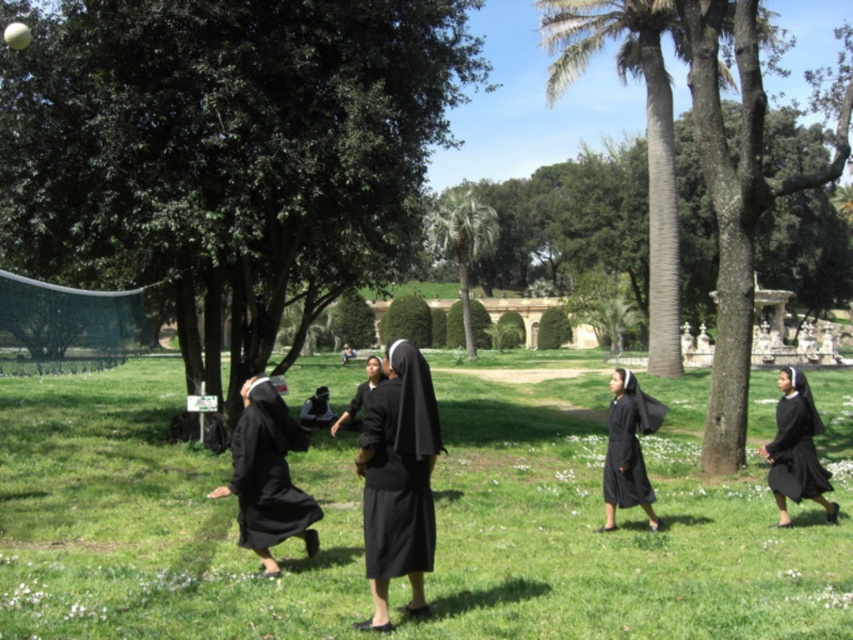
Question: Can you confirm if black matte dress at center is positioned to the right of black matte nun at center?

Choices:
 (A) no
 (B) yes

Answer: (A)

Question: Is smooth brown palm tree at right thinner than black matte dress at right?

Choices:
 (A) yes
 (B) no

Answer: (B)

Question: Is green grass at center above black matte dress at center?

Choices:
 (A) yes
 (B) no

Answer: (B)

Question: Which point is closer to the camera?

Choices:
 (A) (317, 417)
 (B) (457, 195)

Answer: (A)

Question: Which point is closer to the camera taking this photo?

Choices:
 (A) (611, 387)
 (B) (309, 416)

Answer: (A)

Question: Which of these objects is positioned closest to the black matte dress at center?

Choices:
 (A) black matte dress at right
 (B) matte black habit at center

Answer: (B)